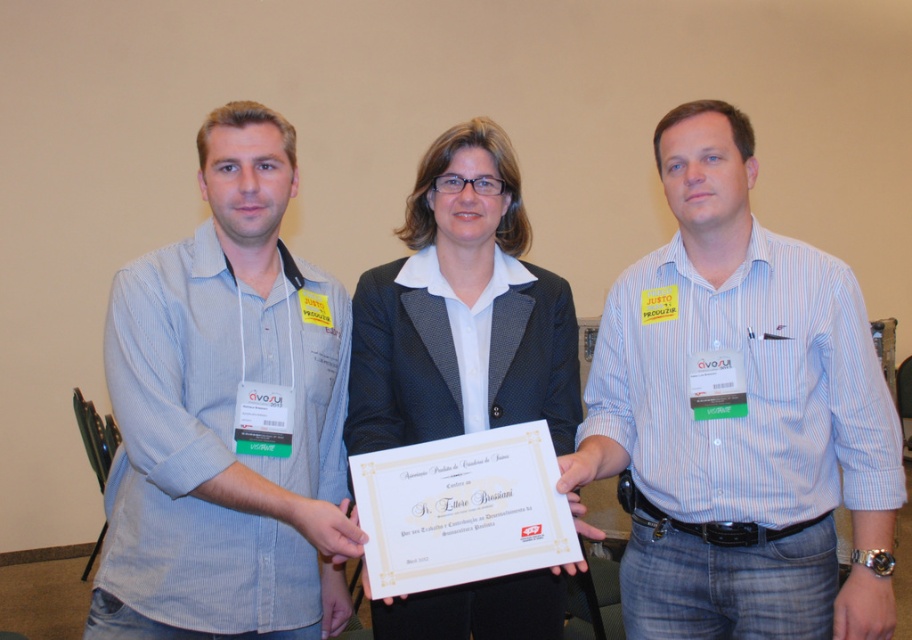
Question: Can you confirm if blue striped shirt at center is smaller than light blue striped shirt at center?

Choices:
 (A) yes
 (B) no

Answer: (B)

Question: Is blue striped shirt at center positioned in front of light blue striped shirt at center?

Choices:
 (A) no
 (B) yes

Answer: (A)

Question: Which of the following is the closest to the observer?

Choices:
 (A) tap(772, 248)
 (B) tap(128, 566)

Answer: (B)

Question: Which point is farther from the camera taking this photo?

Choices:
 (A) (696, 182)
 (B) (333, 289)

Answer: (B)

Question: Is blue striped shirt at center positioned at the back of light blue striped shirt at center?

Choices:
 (A) yes
 (B) no

Answer: (A)